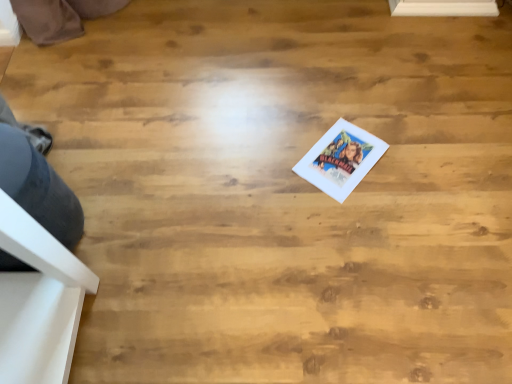
I want to click on vacant region in front of matte paper postcard at center, so click(353, 221).